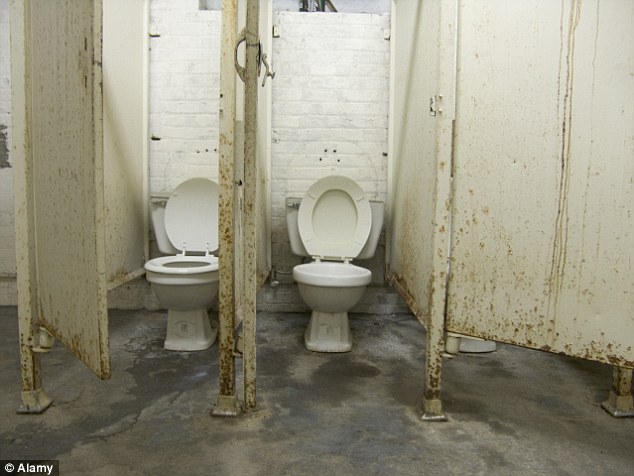
Where is `stall door`? stall door is located at coordinates (480, 144), (63, 166), (252, 124).